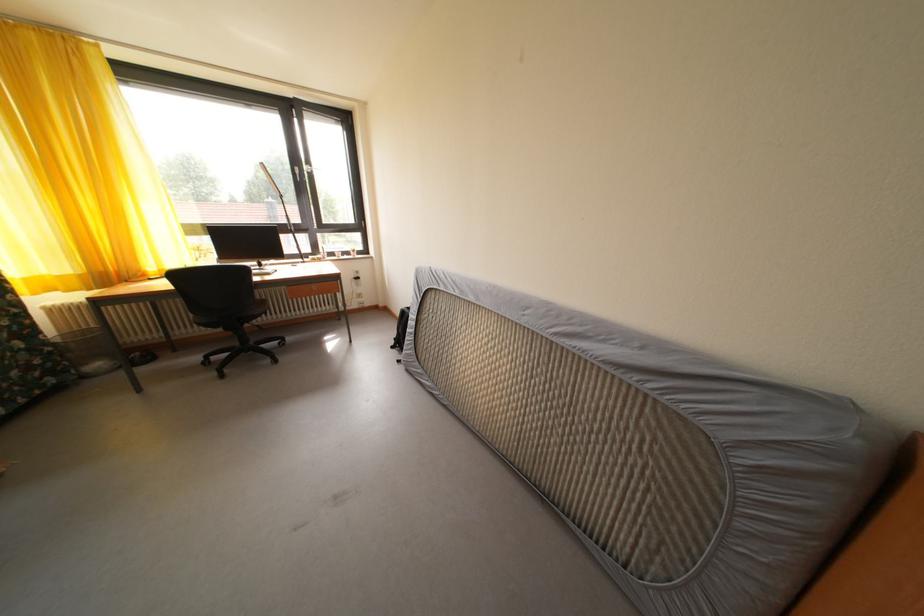
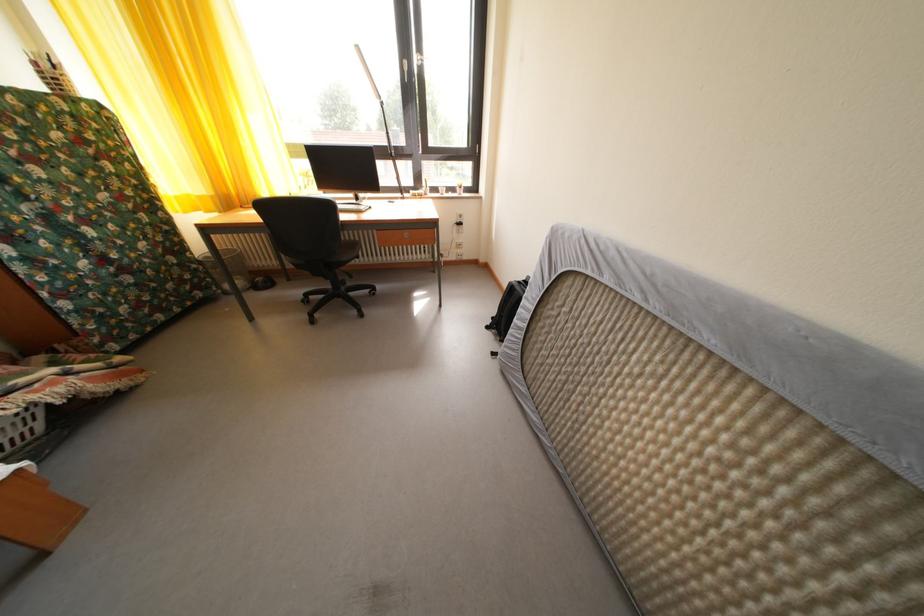
In the second image, find the point that corresponds to point 400,354 in the first image.

(496, 334)